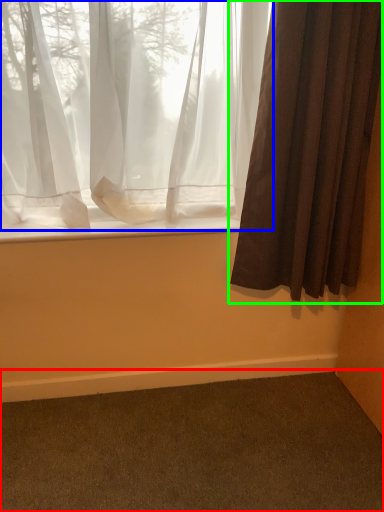
Question: Which is farther away from plain (highlighted by a red box)? curtain (highlighted by a blue box) or curtain (highlighted by a green box)?

Choices:
 (A) curtain
 (B) curtain

Answer: (A)